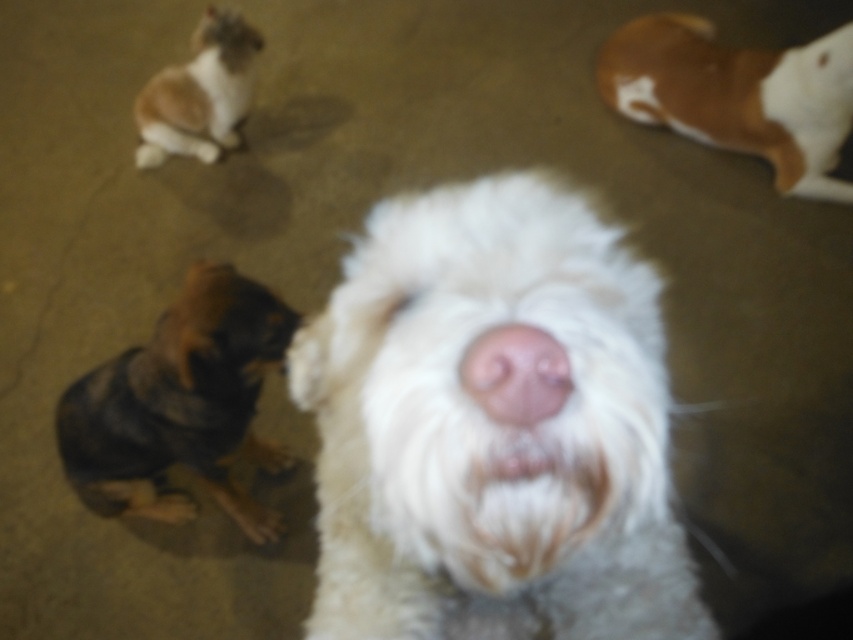
Is white fluffy dog at center in front of brown fur dog at upper left?

Yes, it is.

Is white fluffy dog at center further to the viewer compared to brown fur dog at upper left?

That is False.

Measure the distance between point (518, 426) and camera.

16.63 inches

I want to click on white fluffy dog at center, so click(492, 426).

Does brown fur at upper right have a lesser height compared to pink soft nose at center?

Incorrect, brown fur at upper right's height does not fall short of pink soft nose at center's.

Is brown fur at upper right closer to camera compared to pink soft nose at center?

That is False.

The width and height of the screenshot is (853, 640). Find the location of `brown fur at upper right`. brown fur at upper right is located at coordinates (738, 93).

Does white fluffy dog at center have a smaller size compared to brown and black fur at lower left?

Yes.

Which of these two, white fluffy dog at center or brown and black fur at lower left, stands shorter?

Standing shorter between the two is white fluffy dog at center.

Does point (547, 442) come farther from viewer compared to point (252, 307)?

No, (547, 442) is in front of (252, 307).

The width and height of the screenshot is (853, 640). What are the coordinates of `white fluffy dog at center` in the screenshot? It's located at (492, 426).